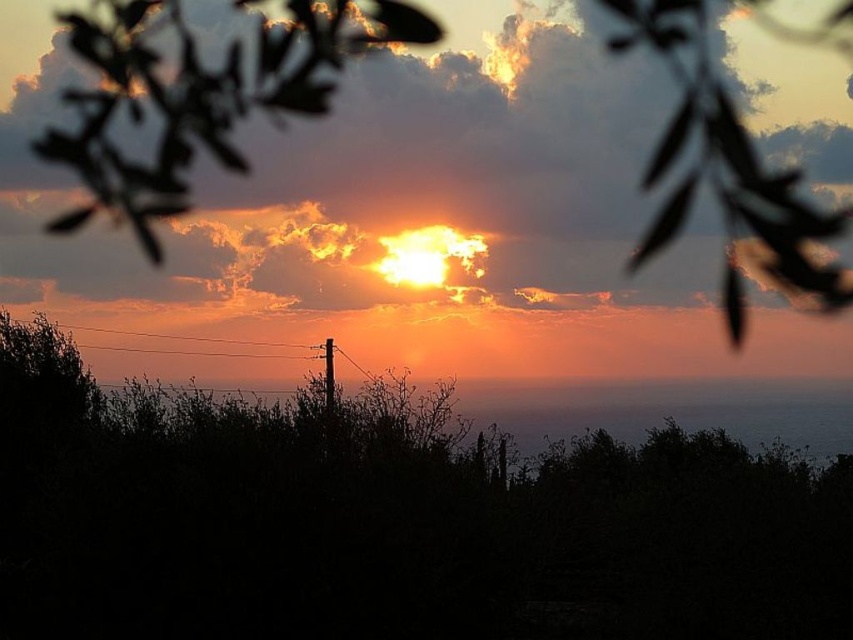
Which is in front, point (326, 344) or point (328, 348)?

Point (326, 344) is in front.

Does smooth wooden telegraph pole at center have a smaller size compared to black wood telegraph pole at center?

Answer: Yes.

Is point (329, 342) positioned behind point (328, 381)?

Yes, it is.

Find the location of a particular element. smooth wooden telegraph pole at center is located at coordinates (328, 376).

Can you confirm if green leafy tree at center is taller than black wood telegraph pole at center?

Indeed, green leafy tree at center has a greater height compared to black wood telegraph pole at center.

Which is behind, point (535, 577) or point (329, 378)?

The point (329, 378) is more distant.

You are a GUI agent. You are given a task and a screenshot of the screen. Output one action in this format:
    pyautogui.click(x=<x>, y=<y>)
    Task: Click on the green leafy tree at center
    
    Given the screenshot: What is the action you would take?
    pyautogui.click(x=390, y=520)

Who is taller, silvery metallic leaves at upper left or black wood telegraph pole at center?

silvery metallic leaves at upper left is taller.

Does silvery metallic leaves at upper left have a larger size compared to black wood telegraph pole at center?

Correct, silvery metallic leaves at upper left is larger in size than black wood telegraph pole at center.

This screenshot has width=853, height=640. Find the location of `silvery metallic leaves at upper left`. silvery metallic leaves at upper left is located at coordinates (196, 99).